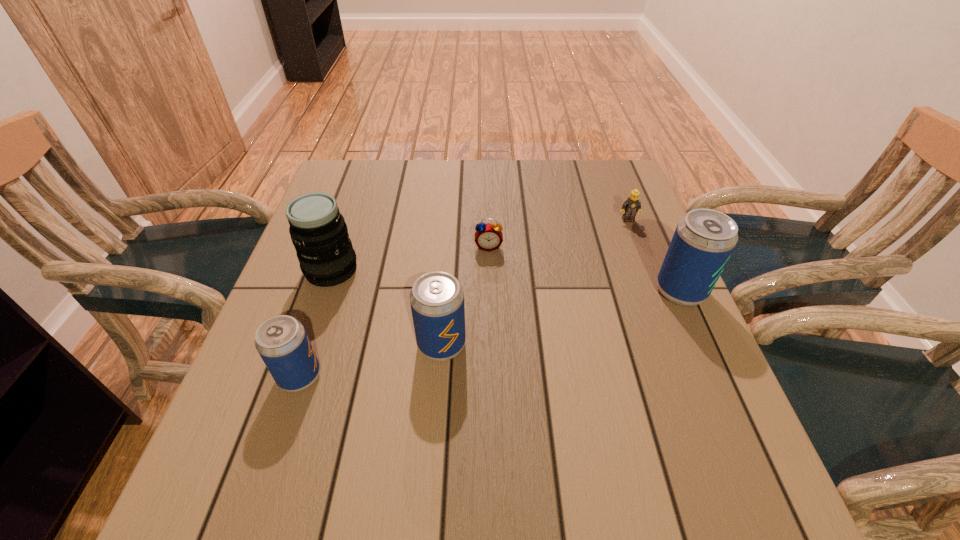
Where is `empty space that is in between the rightmost beer can and the telephoto lens`? empty space that is in between the rightmost beer can and the telephoto lens is located at coordinates (506, 281).

The image size is (960, 540). I want to click on free spot between the fourth object from right to left and the fifth nearest object, so click(x=465, y=295).

Where is `free space between the farthest beer can and the Lego`? free space between the farthest beer can and the Lego is located at coordinates point(654,255).

Locate an element on the screen. unoccupied area between the second tallest beer can and the Lego is located at coordinates (535, 282).

Where is `vacant area that lies between the farthest object and the farthest beer can`? The image size is (960, 540). vacant area that lies between the farthest object and the farthest beer can is located at coordinates pos(654,255).

Choose which object is the third nearest neighbor to the second farthest object. Please provide its 2D coordinates. Your answer should be formatted as a tuple, i.e. [(x, y)], where the tuple contains the x and y coordinates of a point satisfying the conditions above.

[(632, 205)]

I want to click on the third closest object to the farthest beer can, so click(x=437, y=298).

The image size is (960, 540). What are the coordinates of `beer can that is the second closest to the fifth nearest object` in the screenshot? It's located at (704, 239).

Locate an element on the screen. beer can that is the second closest one to the fourth object from right to left is located at coordinates (704, 239).

Where is `vacant space that satisfies the following two spatial constraints: 1. on the front-facing side of the rightmost beer can; 2. on the left side of the fourth object from left to right`? The height and width of the screenshot is (540, 960). vacant space that satisfies the following two spatial constraints: 1. on the front-facing side of the rightmost beer can; 2. on the left side of the fourth object from left to right is located at coordinates (490, 291).